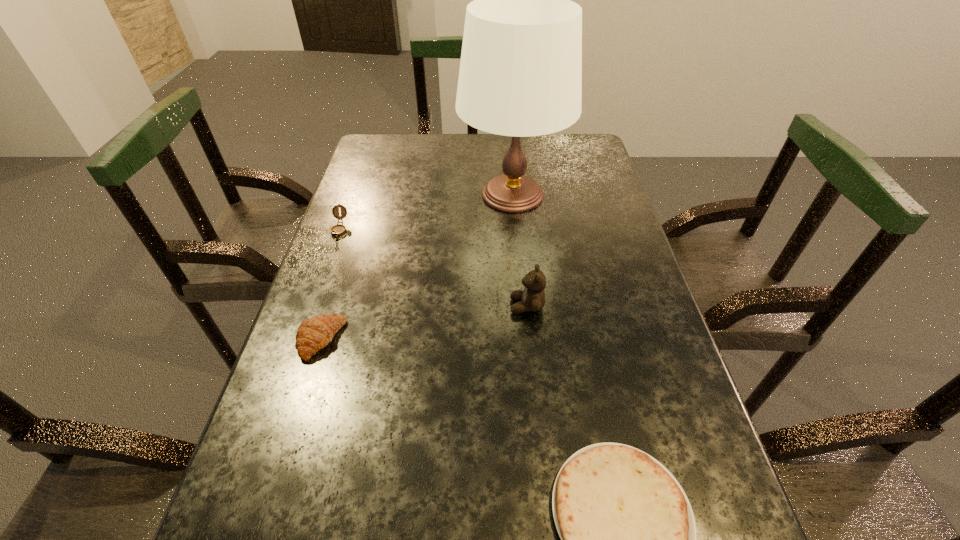
Identify the location of the tallest object. The image size is (960, 540). (520, 75).

Where is `teddy bear`? The width and height of the screenshot is (960, 540). teddy bear is located at coordinates (532, 298).

The height and width of the screenshot is (540, 960). Identify the location of compass. (338, 230).

Find the location of `crescent roll`. crescent roll is located at coordinates (313, 334).

The image size is (960, 540). Identify the location of vacant space positioned on the left of the tallest object. (413, 195).

Identify the location of vacant region located on the face of the teddy bear. The height and width of the screenshot is (540, 960). (352, 306).

The height and width of the screenshot is (540, 960). In order to click on vacant region located on the face of the teddy bear in this screenshot , I will do `click(394, 306)`.

The width and height of the screenshot is (960, 540). What are the coordinates of `vacant point located on the face of the teddy bear` in the screenshot? It's located at (380, 306).

Find the location of a particular element. vacant space located on the face of the compass is located at coordinates (292, 363).

Find the location of a particular element. The height and width of the screenshot is (540, 960). vacant space located 0.300m on the right of the crescent roll is located at coordinates (492, 340).